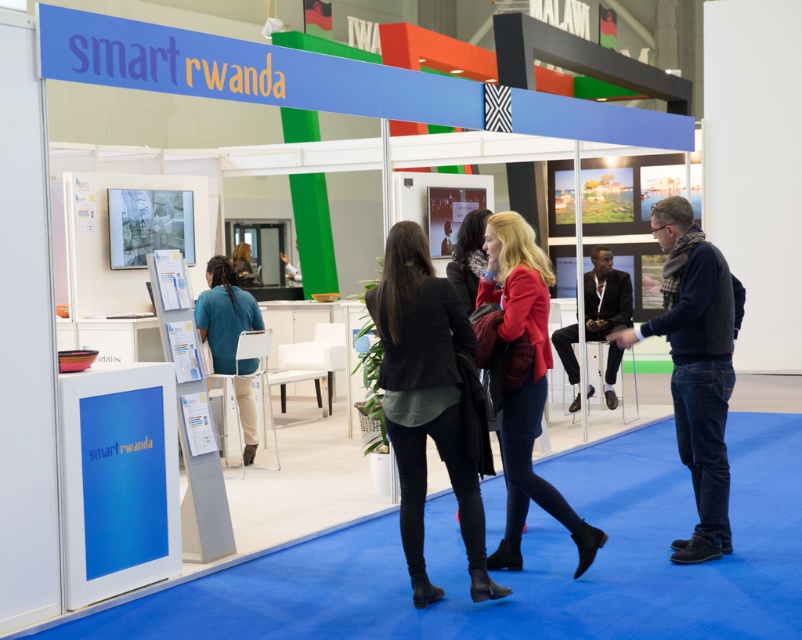
You are a photographer standing at the camera position. You want to capture a closeup shot of the red leather jacket at center. Considering the distance, do you need to use a zoom lens?

The red leather jacket at center is 5.32 meters away from the camera. To capture a closeup shot from that distance, you would need to use a zoom lens to bring the subject into focus and fill the frame.

You are organizing a photo shoot and need to ensure that the red leather jacket at center and the blue fabric shirt at center can fit side by side on a 1.2 meter wide backdrop. Based on their sizes, will they both fit comfortably?

The red leather jacket at center is wider than the blue fabric shirt at center. Since the total width of both items combined may exceed 1.2 meters, they might not fit comfortably side by side on the backdrop.